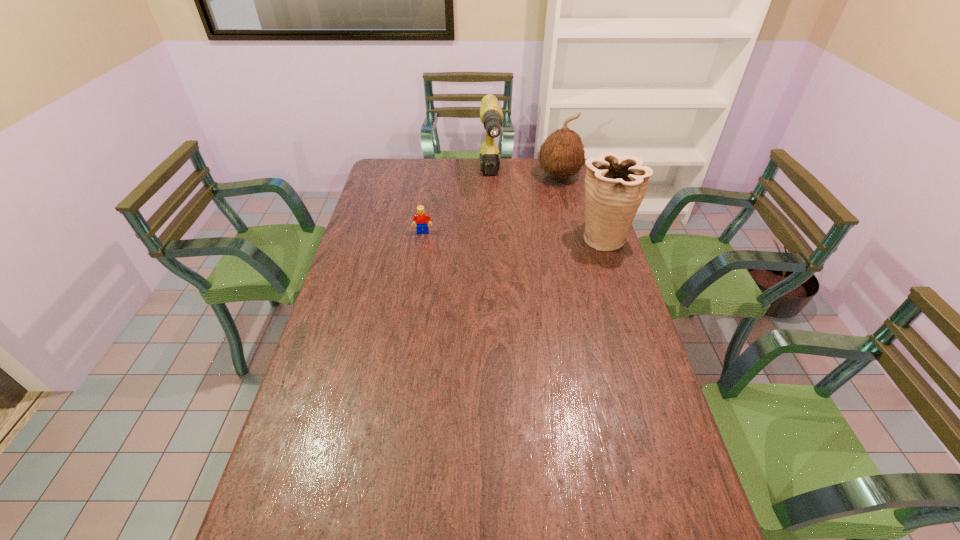
This screenshot has height=540, width=960. Find the location of `vacant space at the left edge of the desktop`. vacant space at the left edge of the desktop is located at coordinates (353, 280).

Where is `vacant region at the right edge of the desktop`? Image resolution: width=960 pixels, height=540 pixels. vacant region at the right edge of the desktop is located at coordinates (561, 222).

Locate an element on the screen. vacant area at the far left corner of the desktop is located at coordinates (390, 183).

The width and height of the screenshot is (960, 540). What are the coordinates of `vacant space at the near right corner of the desktop` in the screenshot? It's located at (638, 528).

This screenshot has width=960, height=540. I want to click on blank region between the coconut and the urn, so click(x=581, y=207).

In order to click on free point between the shortest object and the urn in this screenshot , I will do `click(513, 235)`.

Image resolution: width=960 pixels, height=540 pixels. I want to click on vacant space in between the coconut and the urn, so click(x=581, y=207).

Where is `empty space that is in between the coconut and the urn`? The width and height of the screenshot is (960, 540). empty space that is in between the coconut and the urn is located at coordinates (581, 207).

The image size is (960, 540). I want to click on vacant area that lies between the coconut and the leftmost object, so click(x=491, y=204).

Locate an element on the screen. This screenshot has height=540, width=960. vacant space in between the Lego and the drill is located at coordinates (457, 206).